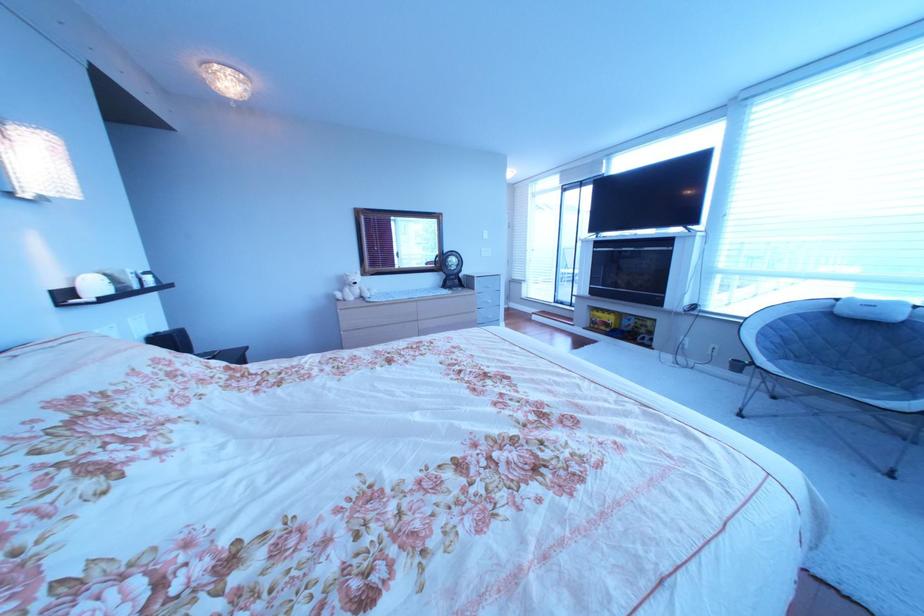
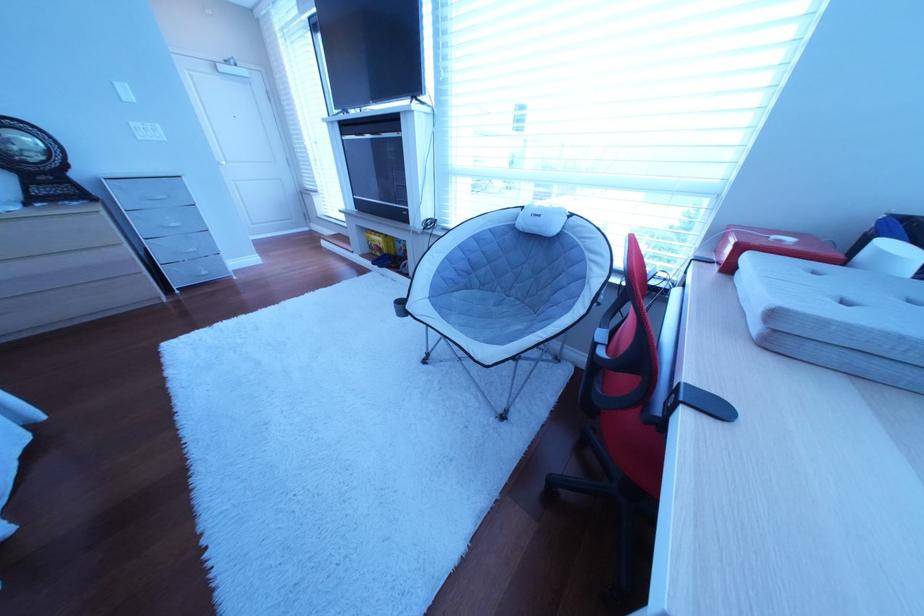
In the second image, find the point that corresponds to point 505,318 in the first image.

(207, 252)